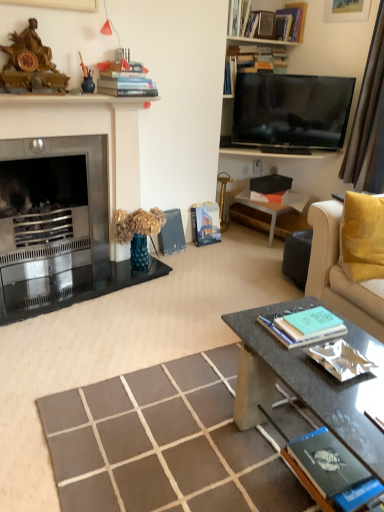
Question: Should I look upward or downward to see matte black fireplace mantel at upper left?

Choices:
 (A) down
 (B) up

Answer: (B)

Question: From a real-world perspective, is hardcover books at upper center, which is the 3th book from top to bottom, physically below metallic fireplace at left?

Choices:
 (A) yes
 (B) no

Answer: (B)

Question: Can you confirm if hardcover books at upper center, which appears as the 7th book when ordered from the bottom, is shorter than metallic fireplace at left?

Choices:
 (A) yes
 (B) no

Answer: (A)

Question: Does hardcover books at upper center, which appears as the 7th book when ordered from the bottom, have a smaller size compared to metallic fireplace at left?

Choices:
 (A) no
 (B) yes

Answer: (B)

Question: Is hardcover books at upper center, which is the 3th book from top to bottom, bigger than metallic fireplace at left?

Choices:
 (A) no
 (B) yes

Answer: (A)

Question: Is hardcover books at upper center, which appears as the 7th book when ordered from the bottom, outside metallic fireplace at left?

Choices:
 (A) yes
 (B) no

Answer: (A)

Question: Does hardcover books at upper center, which is the 3th book from top to bottom, contain metallic fireplace at left?

Choices:
 (A) yes
 (B) no

Answer: (B)

Question: Is hardcover book at center, the 4th book when ordered from bottom to top, located outside flat screen tv at upper right?

Choices:
 (A) yes
 (B) no

Answer: (A)

Question: Can you confirm if hardcover book at center, which is the 6th book from top to bottom, is bigger than flat screen tv at upper right?

Choices:
 (A) no
 (B) yes

Answer: (A)

Question: Considering the relative sizes of hardcover book at center, the 4th book when ordered from bottom to top, and flat screen tv at upper right in the image provided, is hardcover book at center, the 4th book when ordered from bottom to top, thinner than flat screen tv at upper right?

Choices:
 (A) no
 (B) yes

Answer: (B)

Question: Is hardcover book at center, the 4th book when ordered from bottom to top, surrounding flat screen tv at upper right?

Choices:
 (A) yes
 (B) no

Answer: (B)

Question: From a real-world perspective, is hardcover book at center, which is the 6th book from top to bottom, positioned over flat screen tv at upper right based on gravity?

Choices:
 (A) yes
 (B) no

Answer: (B)

Question: Considering the relative sizes of hardcover book at center, which is the 6th book from top to bottom, and flat screen tv at upper right in the image provided, is hardcover book at center, which is the 6th book from top to bottom, taller than flat screen tv at upper right?

Choices:
 (A) yes
 (B) no

Answer: (B)

Question: Could hardcover book at center, the fifth book viewed from the top, be considered to be inside soft yellow fabric couch at right?

Choices:
 (A) no
 (B) yes

Answer: (A)